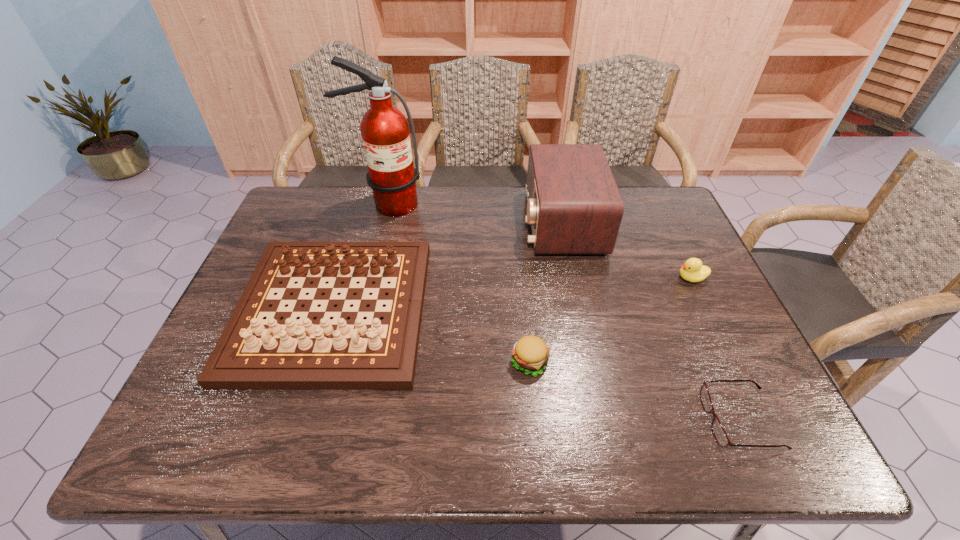
Where is `object present at the near edge`? object present at the near edge is located at coordinates (720, 435).

Image resolution: width=960 pixels, height=540 pixels. In order to click on object at the left edge in this screenshot , I will do `click(251, 353)`.

This screenshot has width=960, height=540. I want to click on duckling that is at the right edge, so click(x=692, y=270).

Locate an element on the screen. spectacles that is at the right edge is located at coordinates (720, 435).

At what (x,y) coordinates should I click in order to perform the action: click on object situated at the near right corner. Please return your answer as a coordinate pair (x, y). The image size is (960, 540). Looking at the image, I should click on (720, 435).

The image size is (960, 540). In the image, there is a desktop. In order to click on vacant space at the far edge in this screenshot , I will do `click(501, 223)`.

In the image, there is a desktop. Identify the location of vacant space at the near edge. (323, 441).

Where is `free space at the right edge`? This screenshot has height=540, width=960. free space at the right edge is located at coordinates (710, 287).

In the image, there is a desktop. Identify the location of vacant space at the far left corner. Image resolution: width=960 pixels, height=540 pixels. (325, 205).

What are the coordinates of `vacant space at the far right corner of the desktop` in the screenshot? It's located at (646, 212).